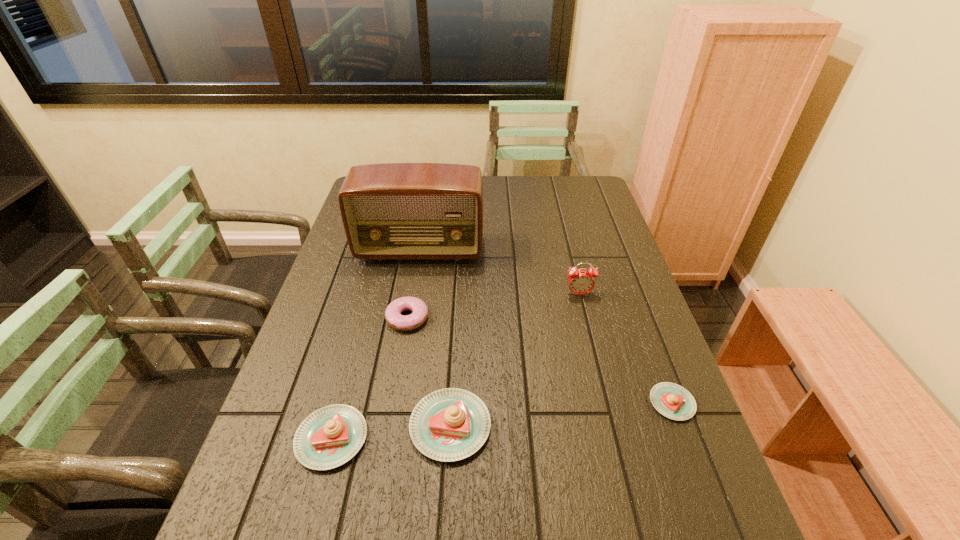
This screenshot has width=960, height=540. Find the location of `alarm clock situated at the right edge`. alarm clock situated at the right edge is located at coordinates (580, 282).

Locate an element on the screen. Image resolution: width=960 pixels, height=540 pixels. object at the near left corner is located at coordinates (329, 437).

This screenshot has height=540, width=960. Find the location of `vacant space at the far edge`. vacant space at the far edge is located at coordinates (506, 188).

Locate an element on the screen. vacant area at the near edge of the desktop is located at coordinates (483, 470).

Find the location of a particular element. blank space at the left edge of the desktop is located at coordinates (368, 295).

Find the location of a particular element. The height and width of the screenshot is (540, 960). free point at the right edge is located at coordinates (593, 230).

Locate an element on the screen. free space at the far right corner of the desktop is located at coordinates (592, 187).

Find the location of a particular element. The width and height of the screenshot is (960, 540). vacant point located between the third shortest object and the alarm clock is located at coordinates (455, 366).

You are a GUI agent. You are given a task and a screenshot of the screen. Output one action in this format:
    pyautogui.click(x=<x>, y=<y>)
    Task: Click on the free space that is in between the alarm clock and the fourth nearest object
    This screenshot has width=960, height=540.
    Given the screenshot: What is the action you would take?
    pyautogui.click(x=493, y=306)

The image size is (960, 540). In order to click on empty space that is in between the second pastry from right to left and the alarm clock in this screenshot , I will do (x=515, y=360).